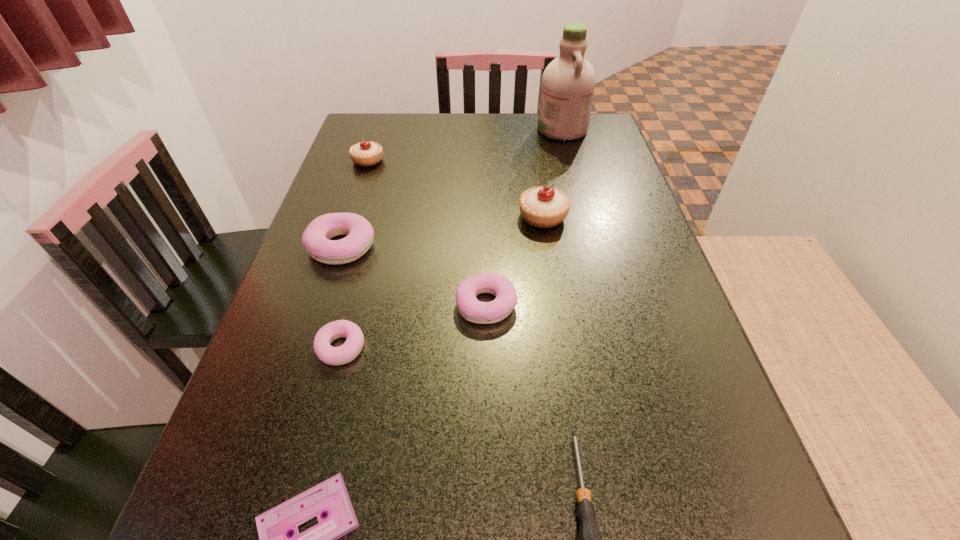
Find the location of a particular element. This screenshot has width=960, height=540. the smallest pink pastry is located at coordinates (353, 345).

This screenshot has height=540, width=960. What are the coordinates of `vacant point located 0.320m on the front label of the tallest object` in the screenshot? It's located at (432, 129).

Locate an element on the screen. vacant space situated on the front label of the tallest object is located at coordinates (471, 129).

Locate an element on the screen. The image size is (960, 540). vacant space situated on the front label of the tallest object is located at coordinates (492, 129).

Identify the location of free space located 0.330m on the front of the tallest pastry. The image size is (960, 540). (564, 355).

Locate an element on the screen. vacant space located on the right of the second farthest object is located at coordinates (468, 160).

Identify the location of vacant space situated on the back of the third tallest pastry. (371, 158).

You are a GUI agent. You are given a task and a screenshot of the screen. Output one action in this format:
    pyautogui.click(x=<x>, y=<y>)
    Task: Click on the vacant space situated 0.080m on the back of the second shortest pastry
    The width and height of the screenshot is (960, 540).
    Given the screenshot: What is the action you would take?
    pyautogui.click(x=486, y=256)

In order to click on vacant space located on the right of the shortest pastry in this screenshot , I will do `click(410, 348)`.

Locate an element on the screen. cleansing agent located at the far edge is located at coordinates (568, 83).